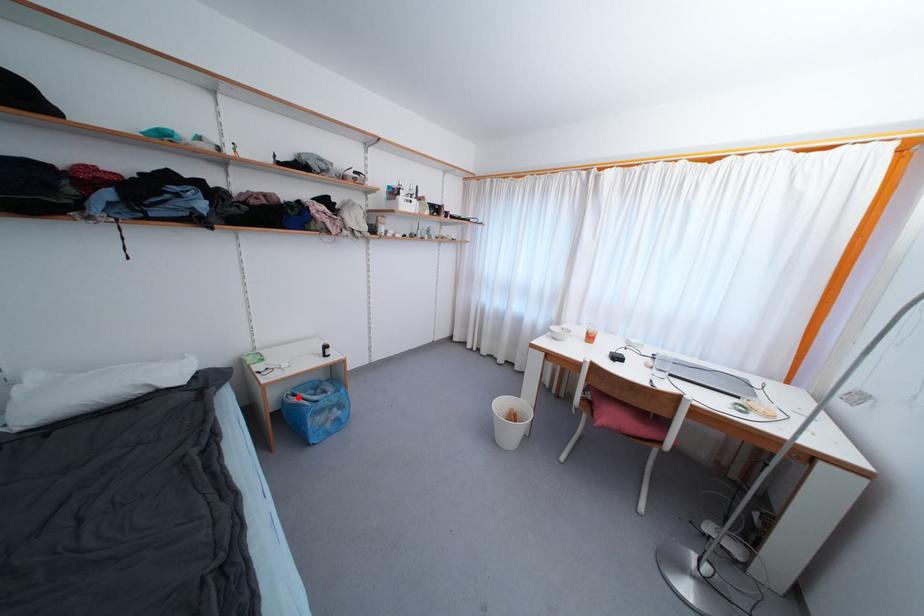
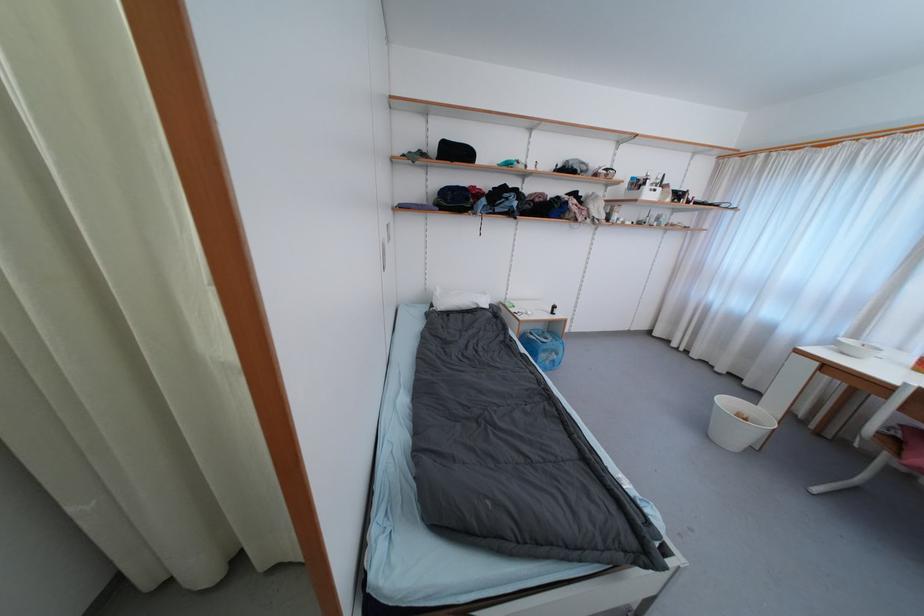
Question: I am providing you with two images of the same scene from different viewpoints. A red point is shown in image1. For the corresponding object point in image2, is it positioned nearer or farther from the camera?

Choices:
 (A) Nearer
 (B) Farther

Answer: (B)